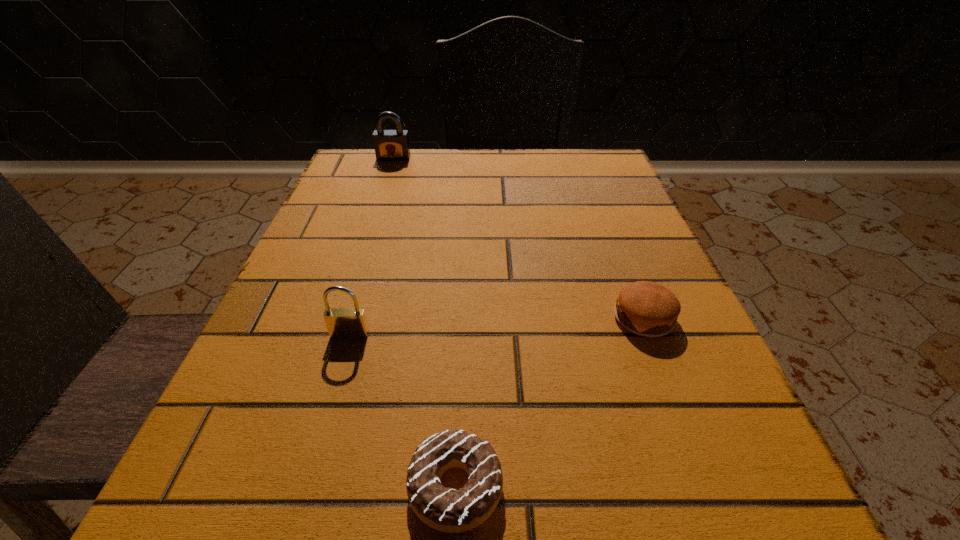
Locate an element on the screen. The width and height of the screenshot is (960, 540). vacant space that is in between the third object from left to right and the hamburger is located at coordinates (550, 403).

In order to click on object that stands as the closest to the nearest object in this screenshot , I will do `click(342, 323)`.

The image size is (960, 540). What are the coordinates of `object that ranks as the third closest to the hamburger` in the screenshot? It's located at (390, 145).

This screenshot has width=960, height=540. I want to click on free space that satisfies the following two spatial constraints: 1. on the front of the third tallest object near the keyhole; 2. on the left side of the tallest object, so click(x=341, y=319).

At what (x,y) coordinates should I click in order to perform the action: click on vacant space that satisfies the following two spatial constraints: 1. on the front of the nearest object near the keyhole; 2. on the left side of the taller padlock. Please return your answer as a coordinate pair (x, y). Looking at the image, I should click on (286, 487).

Locate an element on the screen. vacant area that satisfies the following two spatial constraints: 1. on the front of the farther padlock near the keyhole; 2. on the right side of the third object from left to right is located at coordinates (286, 487).

This screenshot has height=540, width=960. Identify the location of vacant space that satisfies the following two spatial constraints: 1. on the front-facing side of the second object from right to left; 2. on the right side of the second tallest object. (304, 487).